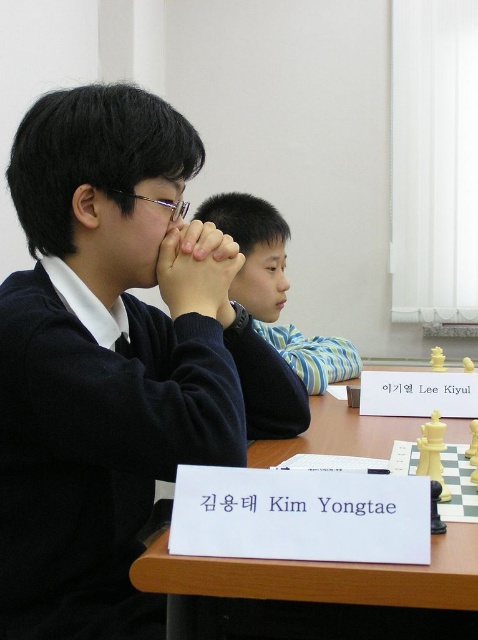
You are a photographer trying to capture a closeup of both the wooden table at center and the blue striped shirt at center in the scene. Considering their sizes, which object should you zoom in on first to ensure both are in focus?

The wooden table at center is smaller than the blue striped shirt at center, so you should zoom in on the blue striped shirt at center first to ensure both are in focus.

You are a photographer standing in front of the scene. You want to take a photo of the dark blue sweater at center and the wooden table at center. Which object will appear larger in your photo?

The dark blue sweater at center is closer to the viewer than the wooden table at center, so it will appear larger in the photo.

You are a fashion designer observing two people sitting at a table. You notice the dark blue sweater at center and the blue striped shirt at center. Which clothing item has a greater width?

The dark blue sweater at center has a greater width than the blue striped shirt at center according to the description.